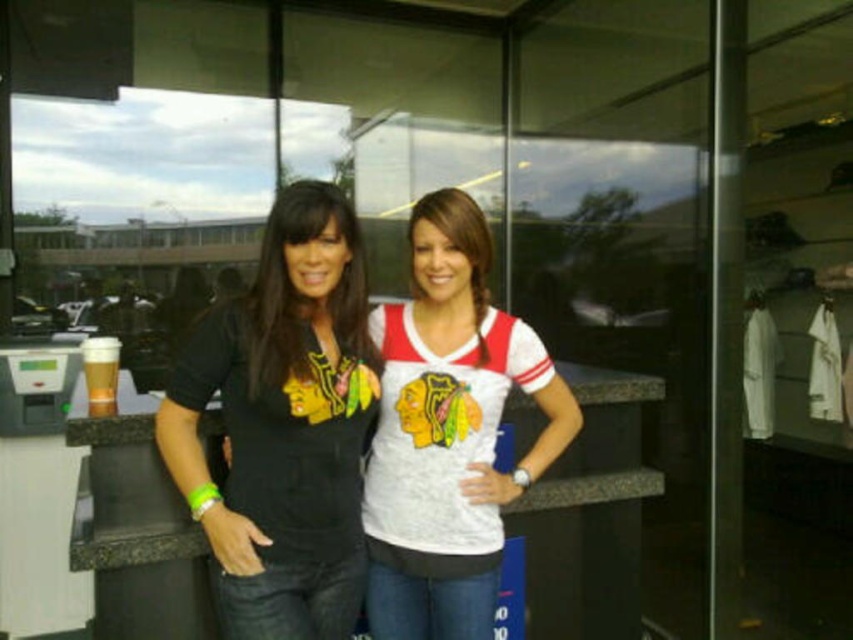
Question: Where is black matte t-shirt at center located in relation to white jersey at center in the image?

Choices:
 (A) right
 (B) left

Answer: (B)

Question: Is black matte t-shirt at center further to camera compared to white jersey at center?

Choices:
 (A) yes
 (B) no

Answer: (B)

Question: Does black matte t-shirt at center have a smaller size compared to white jersey at center?

Choices:
 (A) no
 (B) yes

Answer: (A)

Question: Which point is farther to the camera?

Choices:
 (A) black matte t-shirt at center
 (B) white jersey at center

Answer: (B)

Question: Which point is closer to the camera?

Choices:
 (A) white jersey at center
 (B) black matte t-shirt at center

Answer: (B)